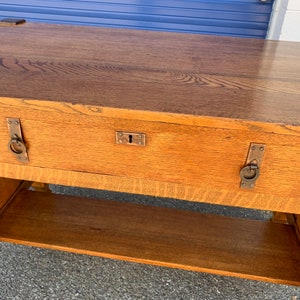
This screenshot has width=300, height=300. In order to click on goldish key hole in this screenshot , I will do `click(139, 134)`.